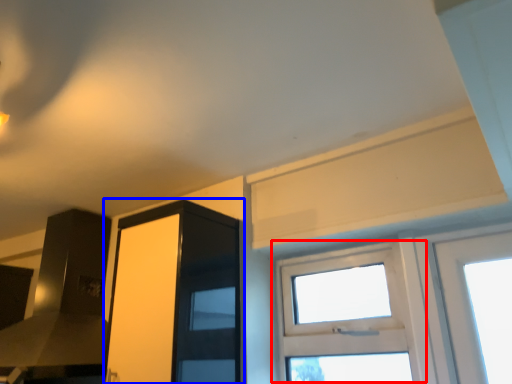
Question: Which object is closer to the camera taking this photo, window (highlighted by a red box) or screen door (highlighted by a blue box)?

Choices:
 (A) window
 (B) screen door

Answer: (B)